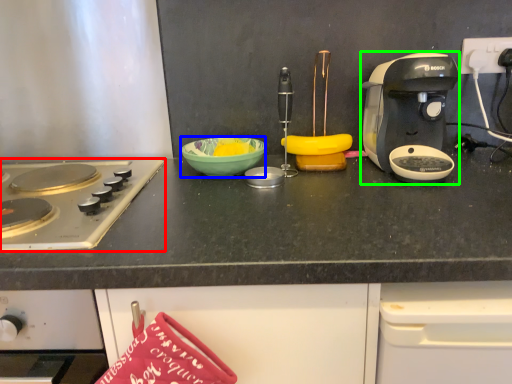
Question: Based on their relative distances, which object is farther from gas stove (highlighted by a red box)? Choose from bowl (highlighted by a blue box) and coffee maker (highlighted by a green box).

Choices:
 (A) bowl
 (B) coffee maker

Answer: (B)